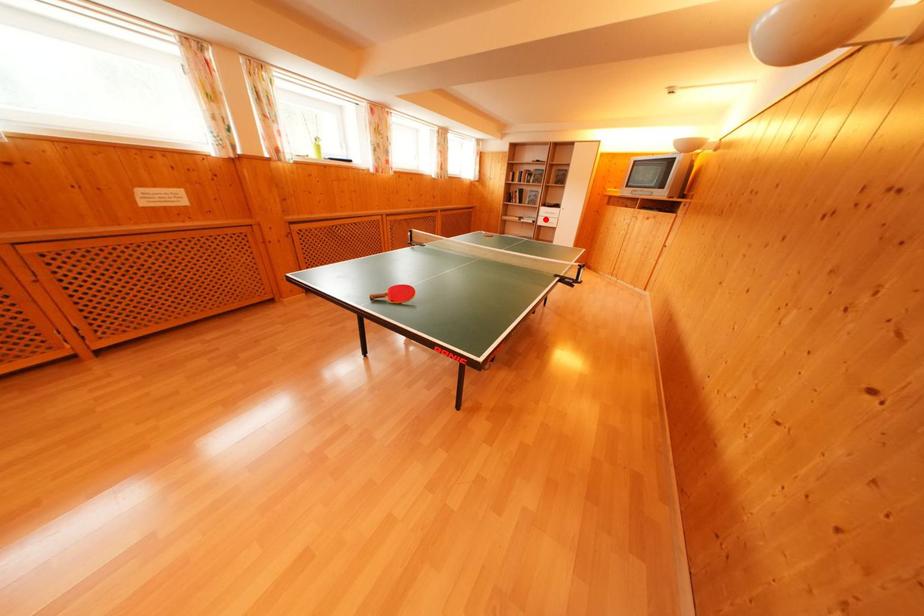
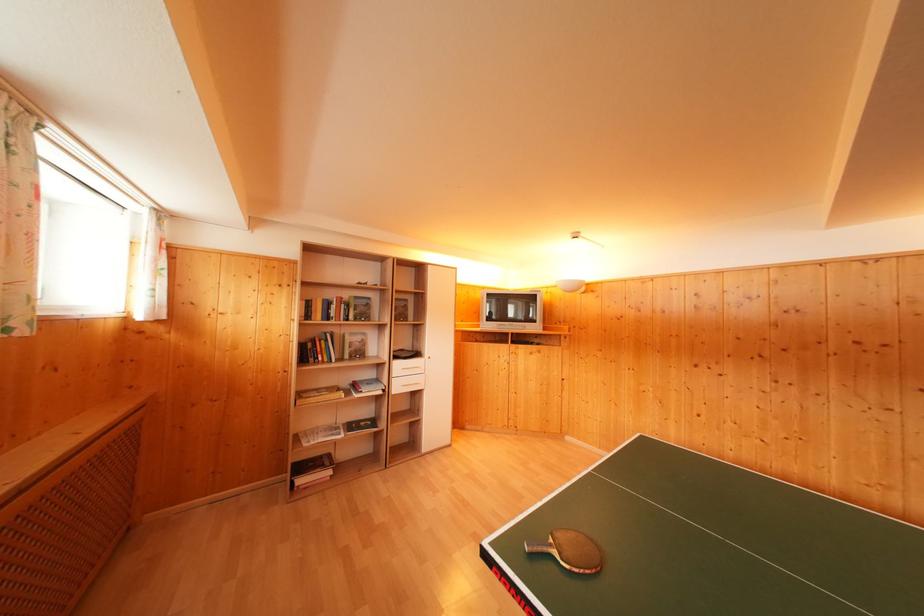
Question: A red point is marked in image1. In image2, is the corresponding 3D point closer to the camera or farther? Reply with the corresponding letter.

Choices:
 (A) The corresponding 3D point is closer.
 (B) The corresponding 3D point is farther.

Answer: (B)